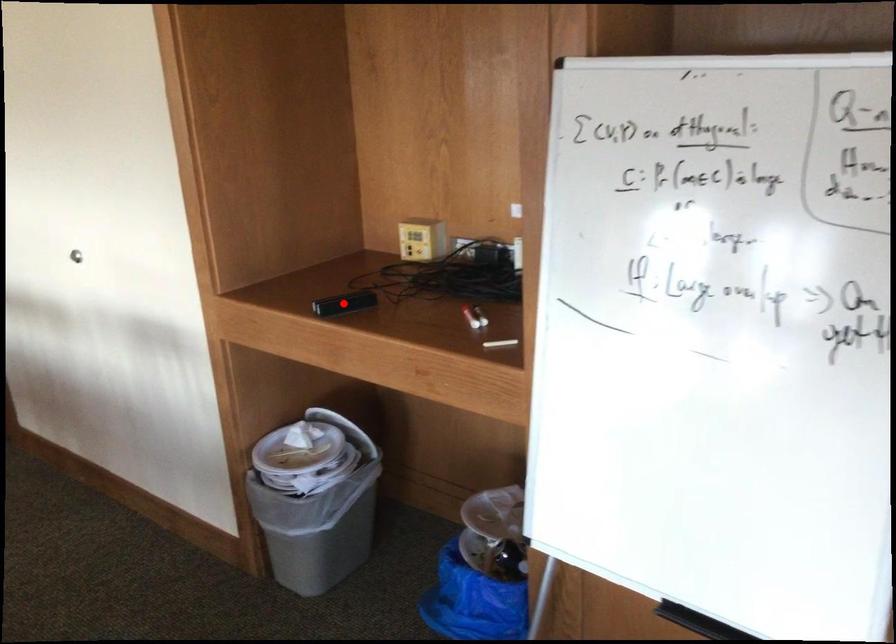
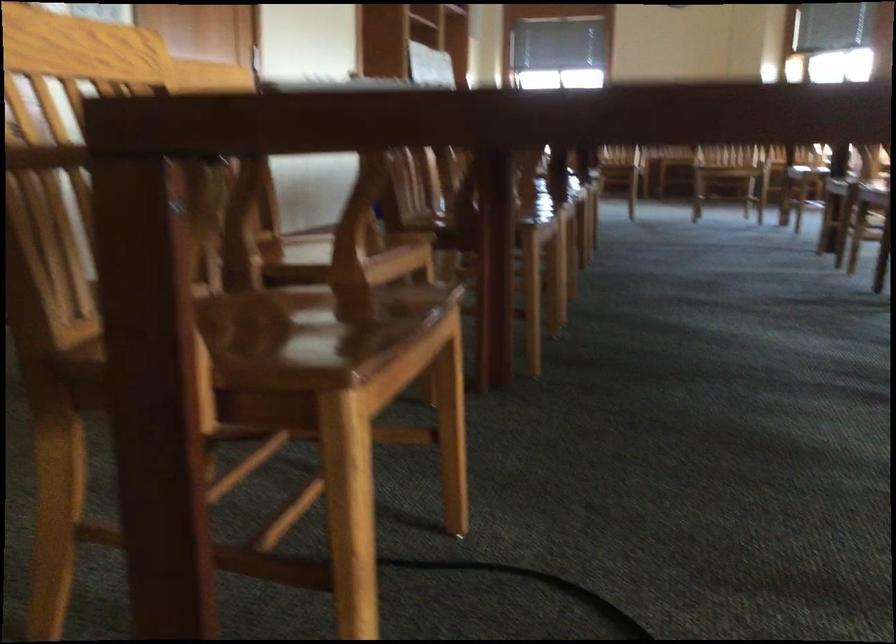
Question: I am providing you with two images of the same scene from different viewpoints. A red point is marked on the first image. At the location where the point appears in image 1, is it still visible in image 2?

Choices:
 (A) Yes
 (B) No

Answer: (B)